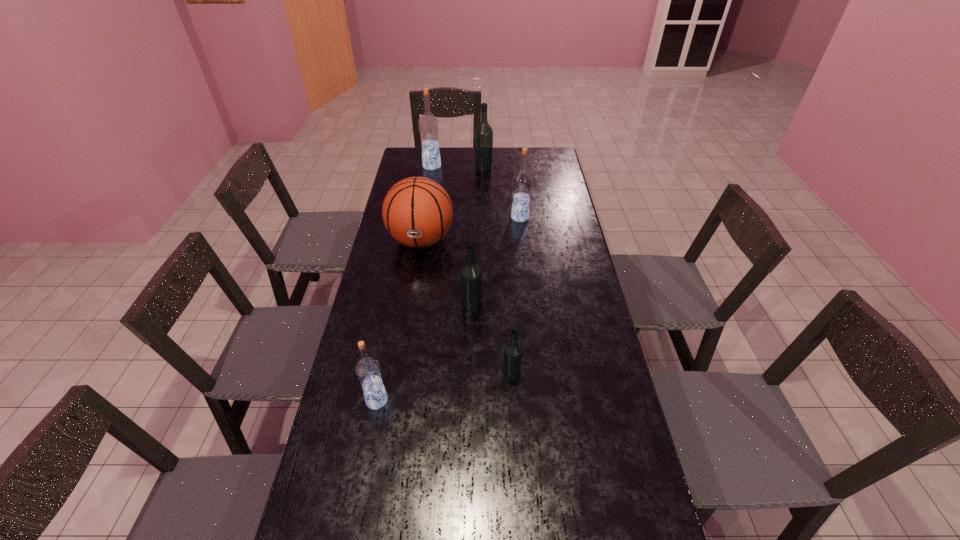
Where is `free space between the rightmost black vodka and the second nearest black vodka`? This screenshot has height=540, width=960. free space between the rightmost black vodka and the second nearest black vodka is located at coordinates (492, 340).

I want to click on vacant point located between the biggest black vodka and the second farthest black vodka, so click(478, 236).

Locate an element on the screen. The height and width of the screenshot is (540, 960). unoccupied area between the tallest object and the biggest black vodka is located at coordinates (458, 167).

Image resolution: width=960 pixels, height=540 pixels. What are the coordinates of `object that is the fifth closest to the tallest vodka` in the screenshot? It's located at (512, 358).

The height and width of the screenshot is (540, 960). Identify the location of the closest object to the rightmost vodka. (417, 212).

Identify which vodka is located as the fifth nearest to the tallest vodka. Please provide its 2D coordinates. Your answer should be formatted as a tuple, i.e. [(x, y)], where the tuple contains the x and y coordinates of a point satisfying the conditions above.

[(368, 370)]

Identify which vodka is located as the nearest to the tallest vodka. Please provide its 2D coordinates. Your answer should be formatted as a tuple, i.e. [(x, y)], where the tuple contains the x and y coordinates of a point satisfying the conditions above.

[(483, 134)]

Point out which blue vodka is positioned as the second nearest to the fifth farthest vodka. Please provide its 2D coordinates. Your answer should be formatted as a tuple, i.e. [(x, y)], where the tuple contains the x and y coordinates of a point satisfying the conditions above.

[(522, 180)]

Identify which blue vodka is located as the third nearest to the third nearest object. Please provide its 2D coordinates. Your answer should be formatted as a tuple, i.e. [(x, y)], where the tuple contains the x and y coordinates of a point satisfying the conditions above.

[(428, 124)]

Choose which black vodka is the second nearest neighbor to the orange basketball. Please provide its 2D coordinates. Your answer should be formatted as a tuple, i.e. [(x, y)], where the tuple contains the x and y coordinates of a point satisfying the conditions above.

[(483, 134)]